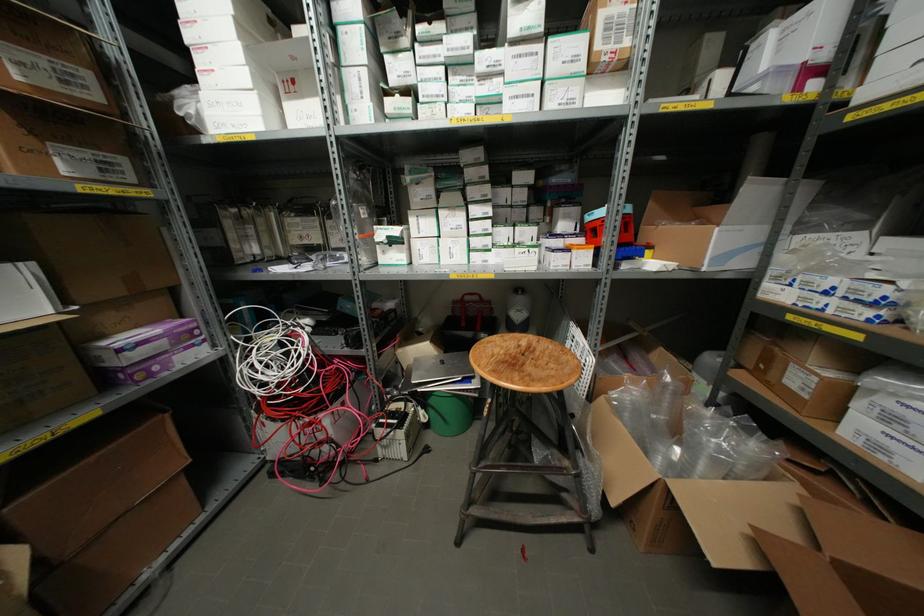
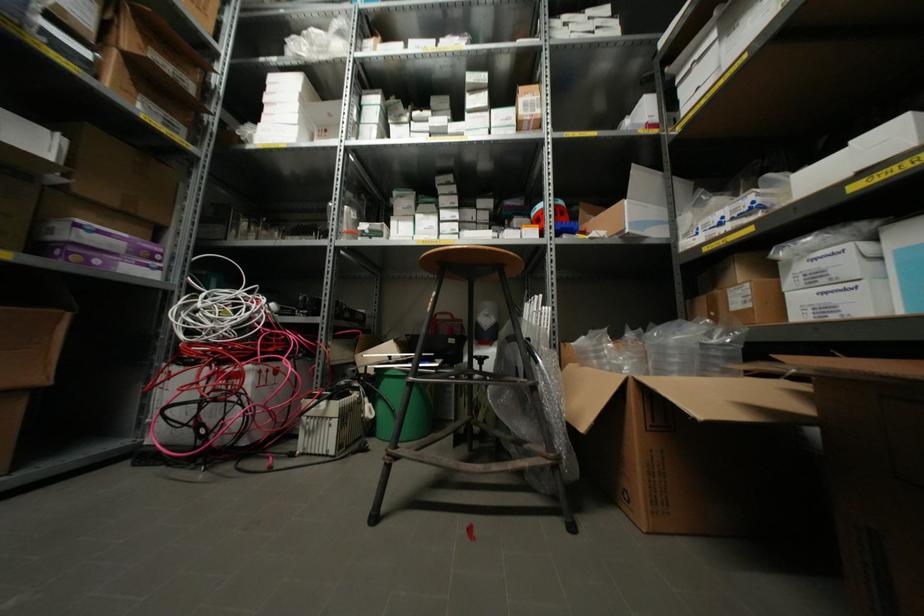
In the scene shown: Which direction would the cameraman need to move to produce the second image?

The movement direction of the cameraman is right, forward.